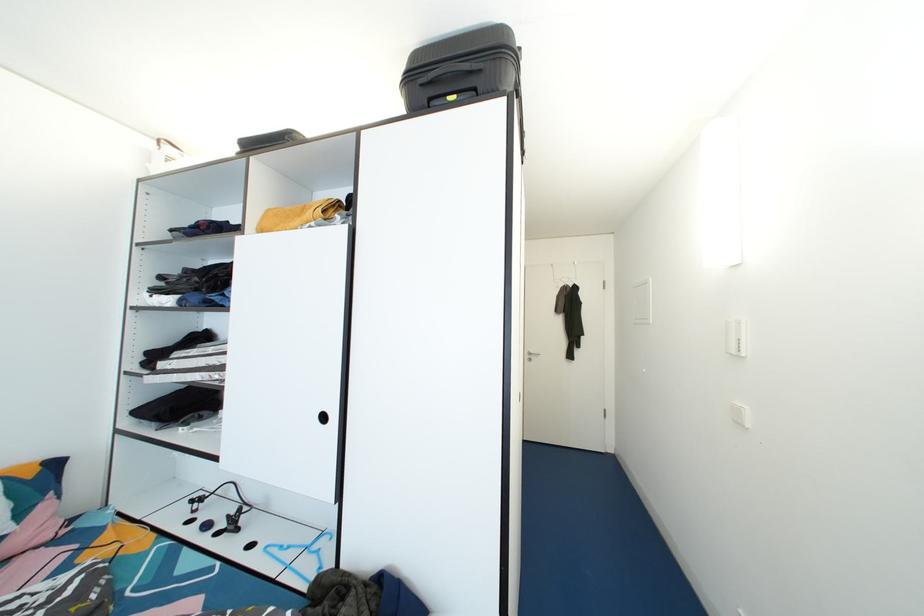
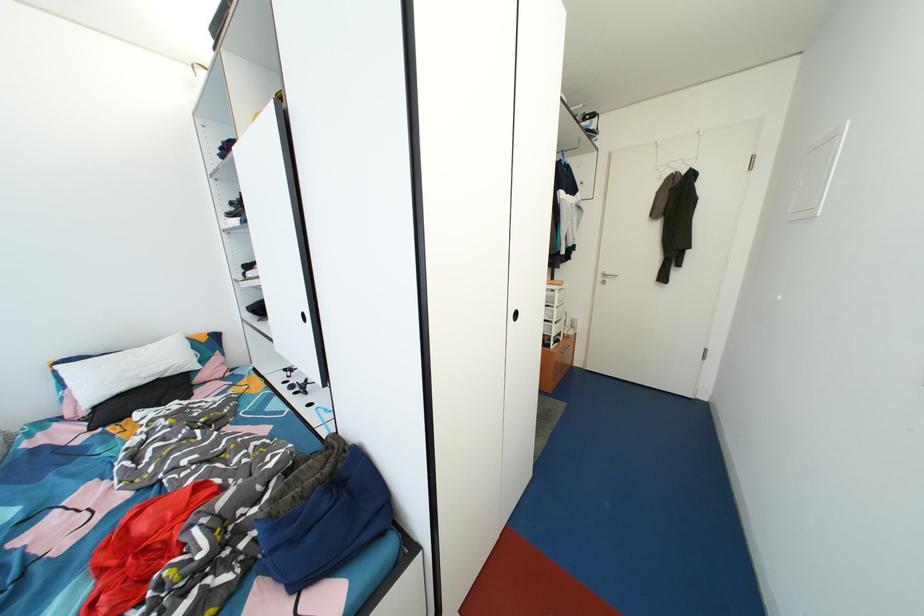
Where in the second image is the point corresponding to (x=201, y=516) from the first image?

(295, 382)